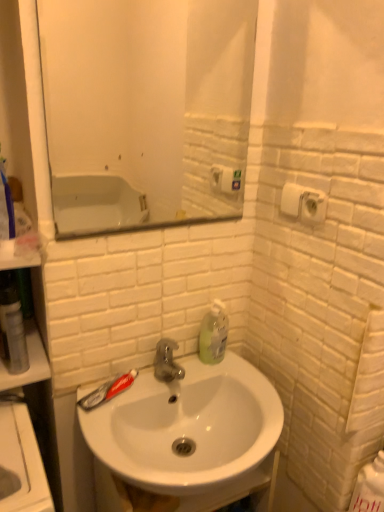
Where is `free space above white glossy sink at center (from a real-world perspective)`? This screenshot has height=512, width=384. free space above white glossy sink at center (from a real-world perspective) is located at coordinates (192, 377).